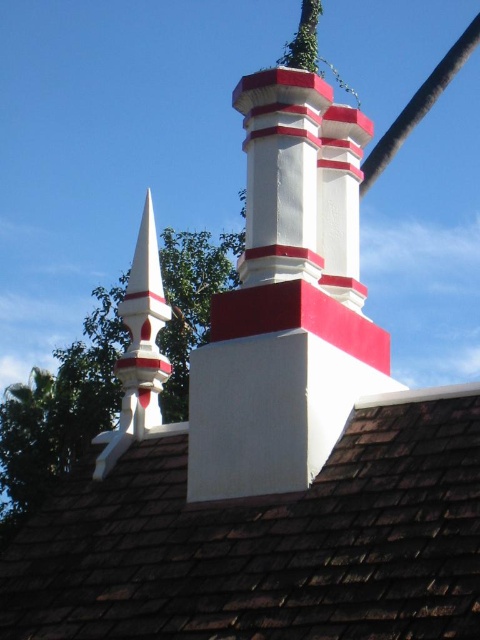
Does white painted brick chimney at upper center have a smaller size compared to black rubber pole at upper center?

Correct, white painted brick chimney at upper center occupies less space than black rubber pole at upper center.

Can you confirm if white painted brick chimney at upper center is positioned to the left of black rubber pole at upper center?

Indeed, white painted brick chimney at upper center is positioned on the left side of black rubber pole at upper center.

Who is more distant from viewer, (x=304, y=353) or (x=382, y=145)?

The point (x=382, y=145) is behind.

Find the location of a particular element. The image size is (480, 640). white painted brick chimney at upper center is located at coordinates (282, 308).

Who is positioned more to the right, brown shingles at upper center or white painted brick chimney at upper center?

Positioned to the right is white painted brick chimney at upper center.

Is brown shingles at upper center taller than white painted brick chimney at upper center?

In fact, brown shingles at upper center may be shorter than white painted brick chimney at upper center.

Locate an element on the screen. brown shingles at upper center is located at coordinates (266, 541).

The width and height of the screenshot is (480, 640). Describe the element at coordinates (266, 541) in the screenshot. I see `brown shingles at upper center` at that location.

Does brown shingles at upper center appear over black rubber pole at upper center?

Incorrect, brown shingles at upper center is not positioned above black rubber pole at upper center.

Who is more forward, (x=24, y=621) or (x=384, y=148)?

Positioned in front is point (x=24, y=621).

Locate an element on the screen. brown shingles at upper center is located at coordinates (266, 541).